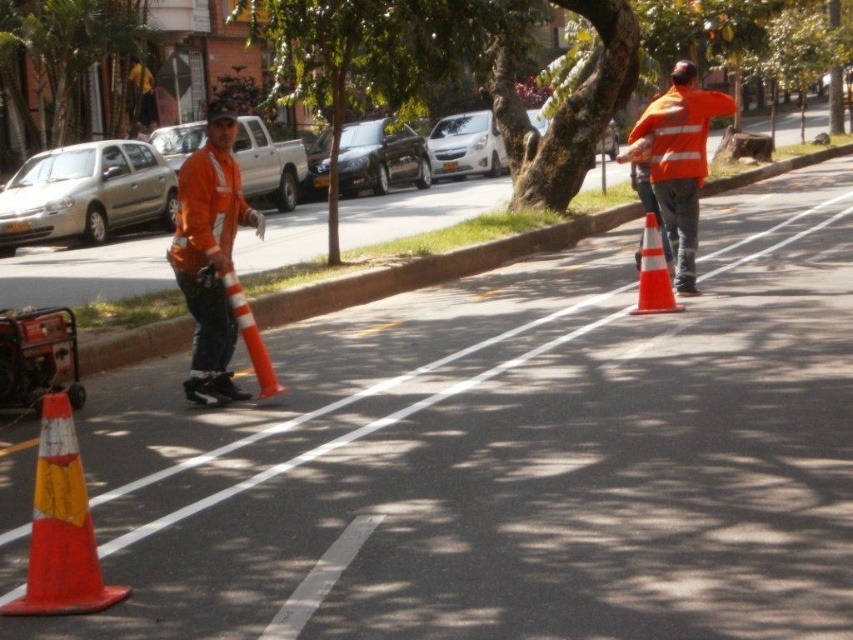
Question: Is orange reflective cone at lower left positioned in front of reflective orange vest at center?

Choices:
 (A) no
 (B) yes

Answer: (B)

Question: Can you confirm if reflective orange vest at center is positioned below orange reflective cone at right?

Choices:
 (A) no
 (B) yes

Answer: (A)

Question: Can you confirm if matte orange safety vest at center is positioned above orange reflective safety vest at center?

Choices:
 (A) yes
 (B) no

Answer: (B)

Question: Among these objects, which one is farthest from the camera?

Choices:
 (A) orange reflective cone at lower left
 (B) matte orange safety vest at center

Answer: (B)

Question: Which point is closer to the camera taking this photo?

Choices:
 (A) (175, 227)
 (B) (648, 308)
 (C) (693, 115)
 (D) (80, 484)

Answer: (D)

Question: Which point is farther from the camera taking this photo?

Choices:
 (A) (222, 106)
 (B) (664, 300)
 (C) (679, 86)

Answer: (C)